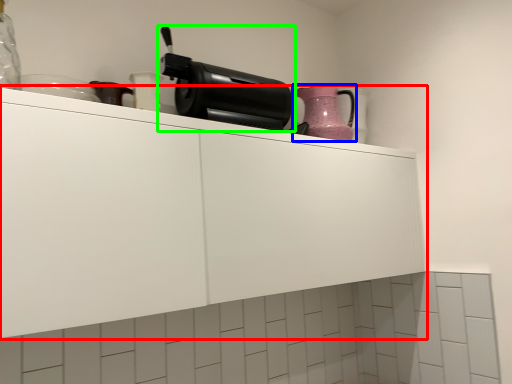
Question: Considering the real-world distances, which object is farthest from cabinetry (highlighted by a red box)? kitchen appliance (highlighted by a blue box) or home appliance (highlighted by a green box)?

Choices:
 (A) kitchen appliance
 (B) home appliance

Answer: (A)